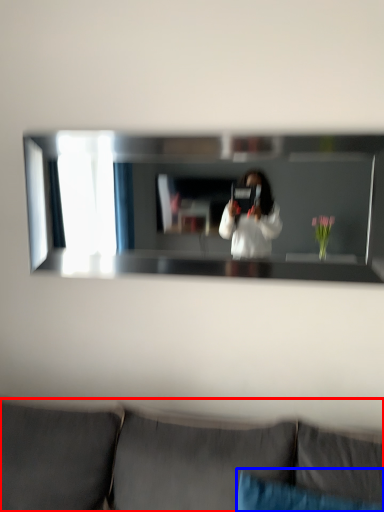
Question: Among these objects, which one is nearest to the camera, studio couch (highlighted by a red box) or pillow (highlighted by a blue box)?

Choices:
 (A) studio couch
 (B) pillow

Answer: (A)